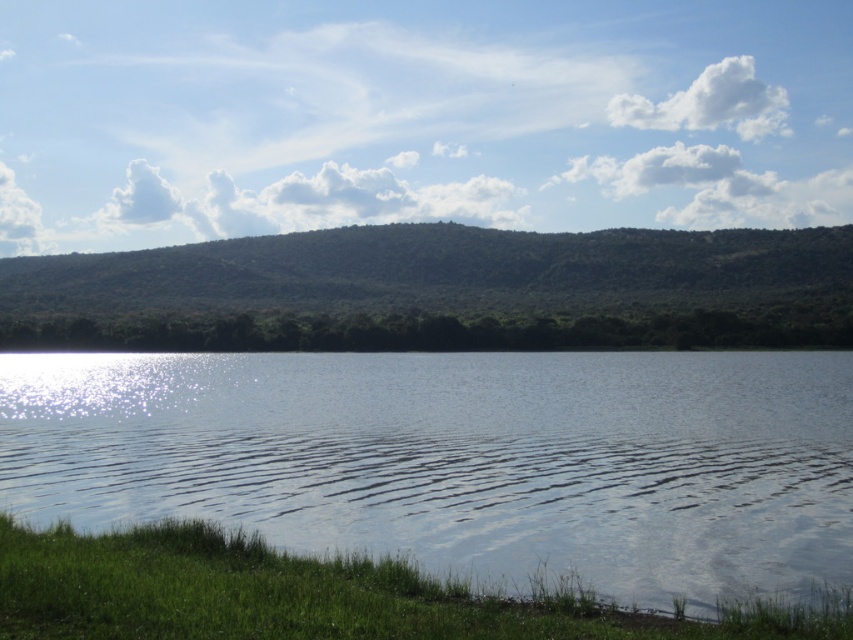
You are an environmental scientist assessing the landscape. You need to determine which area is narrower between the clear water at lower center and the green leafy hill at center. Which one is narrower?

The clear water at lower center is thinner than the green leafy hill at center, so the clear water at lower center is narrower.

You are standing at the edge of the water and see both the clear water at lower center and the clear water ripple at lower center. Which one is positioned more to the right side?

The clear water at lower center is positioned more to the right side than the clear water ripple at lower center.